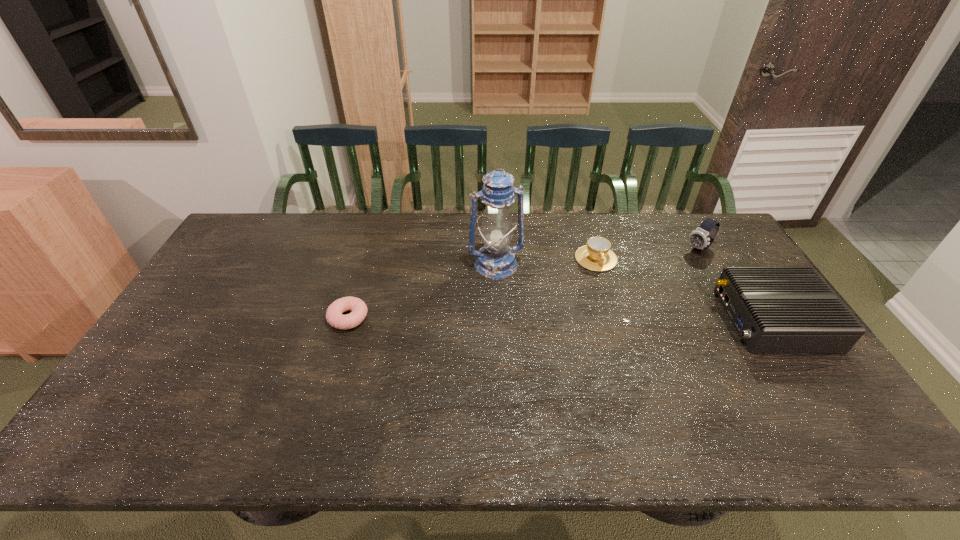
Image resolution: width=960 pixels, height=540 pixels. What are the coordinates of `free space located 0.060m on the face of the watch` in the screenshot? It's located at (680, 262).

Locate an element on the screen. lantern positioned at the far edge is located at coordinates (495, 260).

Identify the location of cup that is at the far edge. coord(596,255).

The height and width of the screenshot is (540, 960). I want to click on watch that is positioned at the far edge, so click(701, 238).

In order to click on router that is at the right edge in this screenshot , I will do `click(775, 309)`.

Locate an element on the screen. watch positioned at the right edge is located at coordinates [701, 238].

What are the coordinates of `object present at the far right corner` in the screenshot? It's located at (701, 238).

In the image, there is a desktop. Identify the location of vacant space at the far edge. (636, 248).

The width and height of the screenshot is (960, 540). In the image, there is a desktop. Identify the location of free space at the near edge. (745, 409).

The image size is (960, 540). What are the coordinates of `vacant position at the left edge of the desktop` in the screenshot? It's located at (179, 311).